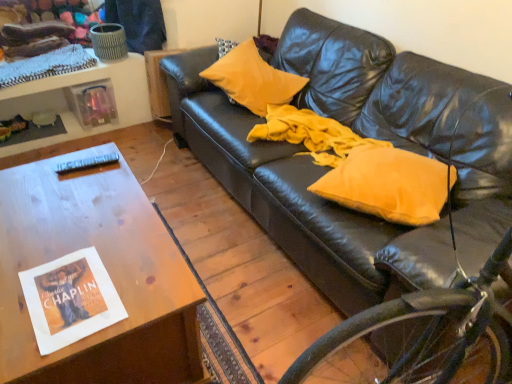
Question: Is yellow fabric pillow at center, which is the 2th pillow from top to bottom, situated inside yellow matte pillow at upper center, which is the 2th pillow in right-to-left order, or outside?

Choices:
 (A) inside
 (B) outside

Answer: (B)

Question: Considering the positions of yellow fabric pillow at center, which is the 2th pillow from top to bottom, and yellow matte pillow at upper center, arranged as the 1th pillow when viewed from the back, in the image, is yellow fabric pillow at center, which is the 2th pillow from top to bottom, wider or thinner than yellow matte pillow at upper center, arranged as the 1th pillow when viewed from the back,?

Choices:
 (A) thin
 (B) wide

Answer: (B)

Question: Estimate the real-world distances between objects in this image. Which object is farther from the white paper magazine at lower left?

Choices:
 (A) black plastic remote control at upper left
 (B) yellow fabric pillow at center, acting as the 1th pillow starting from the right
 (C) leather couch at center
 (D) woodenwoodentable at left
 (E) yellow matte pillow at upper center, the 2th pillow in the bottom-to-top sequence

Answer: (E)

Question: Which is farther from the black plastic remote control at upper left?

Choices:
 (A) yellow fabric pillow at center, which is the 2th pillow from top to bottom
 (B) leather couch at center
 (C) white paper magazine at lower left
 (D) woodenwoodentable at left
 (E) yellow matte pillow at upper center, which is the 2th pillow in right-to-left order

Answer: (B)